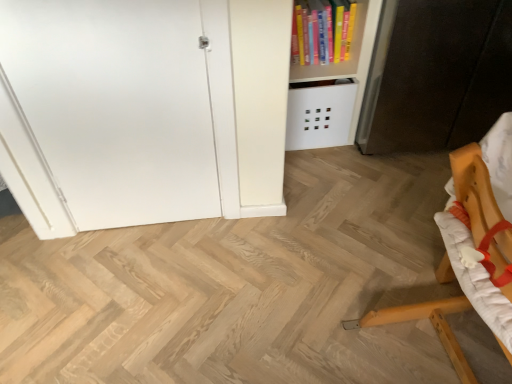
Question: Is dark brown wood cabinet at right a part of wooden chair at lower right?

Choices:
 (A) no
 (B) yes

Answer: (A)

Question: Can you confirm if wooden chair at lower right is positioned to the right of dark brown wood cabinet at right?

Choices:
 (A) no
 (B) yes

Answer: (A)

Question: Is wooden chair at lower right bigger than dark brown wood cabinet at right?

Choices:
 (A) yes
 (B) no

Answer: (B)

Question: Is wooden chair at lower right to the left of dark brown wood cabinet at right from the viewer's perspective?

Choices:
 (A) no
 (B) yes

Answer: (B)

Question: Does wooden chair at lower right come behind dark brown wood cabinet at right?

Choices:
 (A) yes
 (B) no

Answer: (B)

Question: Is wooden chair at lower right not within dark brown wood cabinet at right?

Choices:
 (A) no
 (B) yes

Answer: (B)

Question: Is wooden chair at lower right positioned beyond the bounds of hardcover book at upper right?

Choices:
 (A) no
 (B) yes

Answer: (B)

Question: Is wooden chair at lower right far from hardcover book at upper right?

Choices:
 (A) no
 (B) yes

Answer: (B)

Question: Is hardcover book at upper right a part of wooden chair at lower right?

Choices:
 (A) no
 (B) yes

Answer: (A)

Question: Does wooden chair at lower right have a larger size compared to hardcover book at upper right?

Choices:
 (A) yes
 (B) no

Answer: (A)

Question: Is wooden chair at lower right aimed at hardcover book at upper right?

Choices:
 (A) no
 (B) yes

Answer: (A)

Question: Does wooden chair at lower right have a lesser width compared to hardcover book at upper right?

Choices:
 (A) no
 (B) yes

Answer: (A)

Question: Does white matte door at left have a greater width compared to dark brown wood cabinet at right?

Choices:
 (A) no
 (B) yes

Answer: (A)